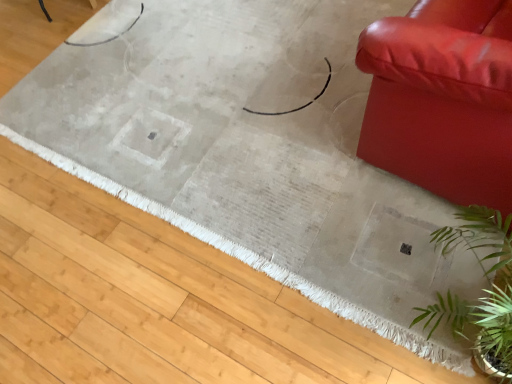
Question: Does green leafy plant at lower right have a smaller size compared to shiny leather couch at right?

Choices:
 (A) yes
 (B) no

Answer: (A)

Question: Is green leafy plant at lower right behind shiny leather couch at right?

Choices:
 (A) no
 (B) yes

Answer: (A)

Question: Is shiny leather couch at right inside green leafy plant at lower right?

Choices:
 (A) no
 (B) yes

Answer: (A)

Question: From the image's perspective, is green leafy plant at lower right located beneath shiny leather couch at right?

Choices:
 (A) no
 (B) yes

Answer: (B)

Question: Is green leafy plant at lower right at the right side of shiny leather couch at right?

Choices:
 (A) no
 (B) yes

Answer: (A)

Question: Is green leafy plant at lower right positioned in front of shiny leather couch at right?

Choices:
 (A) no
 (B) yes

Answer: (B)

Question: From a real-world perspective, is shiny leather couch at right physically below green leafy plant at lower right?

Choices:
 (A) yes
 (B) no

Answer: (B)

Question: Considering the relative sizes of shiny leather couch at right and green leafy plant at lower right in the image provided, is shiny leather couch at right wider than green leafy plant at lower right?

Choices:
 (A) yes
 (B) no

Answer: (A)

Question: Is green leafy plant at lower right at the back of shiny leather couch at right?

Choices:
 (A) yes
 (B) no

Answer: (B)

Question: Is shiny leather couch at right bigger than green leafy plant at lower right?

Choices:
 (A) yes
 (B) no

Answer: (A)

Question: Does shiny leather couch at right have a greater height compared to green leafy plant at lower right?

Choices:
 (A) no
 (B) yes

Answer: (B)

Question: From the image's perspective, would you say shiny leather couch at right is shown under green leafy plant at lower right?

Choices:
 (A) no
 (B) yes

Answer: (A)

Question: Is beige woven rug at center at the left side of shiny leather couch at right?

Choices:
 (A) no
 (B) yes

Answer: (B)